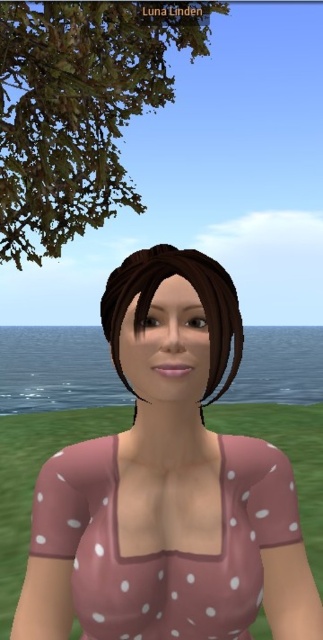
Which is below, green leafy tree at upper left or brown matte hair at center?

brown matte hair at center

Who is positioned more to the left, green leafy tree at upper left or brown matte hair at center?

green leafy tree at upper left

Is point (93, 60) less distant than point (237, 330)?

No, (93, 60) is further to viewer.

Locate an element on the screen. green leafy tree at upper left is located at coordinates (80, 109).

Can you confirm if green leafy tree at upper left is bigger than pink polka dot fabric at center?

Yes.

Which is in front, point (17, 173) or point (107, 589)?

Point (107, 589) is in front.

Which is behind, point (72, 136) or point (290, 529)?

The point (72, 136) is behind.

Identify the location of green leafy tree at upper left. pos(80,109).

Between pink polka dot dress at center and green leafy tree at upper left, which one has more height?

Standing taller between the two is green leafy tree at upper left.

Does pink polka dot dress at center have a lesser width compared to green leafy tree at upper left?

Correct, pink polka dot dress at center's width is less than green leafy tree at upper left's.

The height and width of the screenshot is (640, 323). I want to click on pink polka dot dress at center, so click(x=167, y=484).